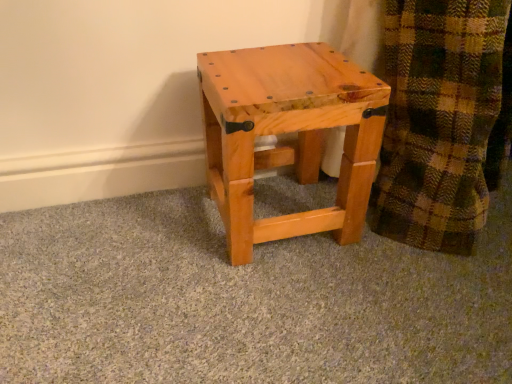
Locate an element on the screen. This screenshot has width=512, height=384. vacant area that is situated to the right of natural wood stool at center is located at coordinates (406, 245).